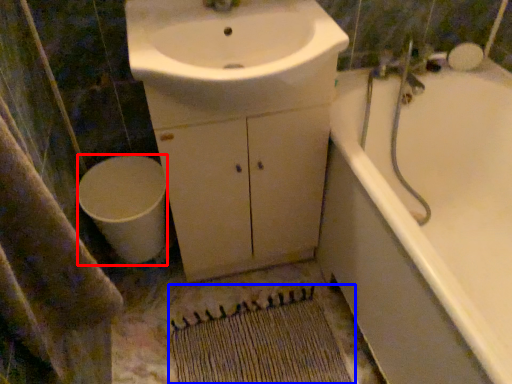
Question: Among these objects, which one is farthest to the camera, toilet (highlighted by a red box) or doormat (highlighted by a blue box)?

Choices:
 (A) toilet
 (B) doormat

Answer: (A)